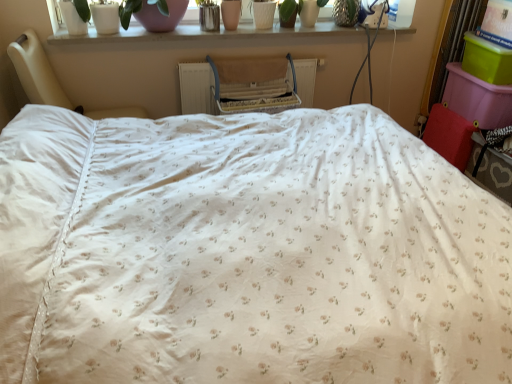
In order to face white plastic window screen at upper right, should I rotate leftwards or rightwards?

Rotate your view right by about 18.949°.

Describe the element at coordinates (246, 253) in the screenshot. The height and width of the screenshot is (384, 512). I see `white floral fabric bed at center` at that location.

Measure the distance between point (175,360) and camera.

Point (175,360) is 37.95 inches away from camera.

What is the approximate height of pink glass vase at upper center?

It is 8.57 inches.

At what (x,y) coordinates should I click in order to perform the action: click on white plastic radiator at center. Please return your answer as a coordinate pair (x, y). The height and width of the screenshot is (384, 512). Looking at the image, I should click on (246, 85).

Locate an element on the screen. The image size is (512, 384). white matte pot at upper center is located at coordinates (300, 11).

Is point (198, 33) more distant than point (290, 3)?

No, it is in front of (290, 3).

Find the location of a particular element. This screenshot has width=512, height=384. plant behind the white painted wood at upper center is located at coordinates (300, 11).

From the image's perspective, is white painted wood at upper center above white matte pot at upper center?

Actually, white painted wood at upper center appears below white matte pot at upper center in the image.

Is white matte pot at upper center completely or partially inside white painted wood at upper center?

No, white painted wood at upper center does not contain white matte pot at upper center.

Could you tell me if white painted wood at upper center is facing white floral fabric bed at center?

Yes.

Which of these two, white painted wood at upper center or white floral fabric bed at center, is bigger?

white floral fabric bed at center is bigger.

Does white painted wood at upper center contain white floral fabric bed at center?

No, white floral fabric bed at center is not inside white painted wood at upper center.

Can you confirm if white painted wood at upper center is wider than white floral fabric bed at center?

No, white painted wood at upper center is not wider than white floral fabric bed at center.

From the image's perspective, is white matte pot at upper center below white fabric bed at left?

Actually, white matte pot at upper center appears above white fabric bed at left in the image.

In the scene shown: Which object is positioned more to the right, white matte pot at upper center or white fabric bed at left?

From the viewer's perspective, white matte pot at upper center appears more on the right side.

Considering the relative positions of white matte pot at upper center and white fabric bed at left in the image provided, is white matte pot at upper center behind white fabric bed at left?

Yes, white matte pot at upper center is further from the viewer.

In terms of width, does white matte pot at upper center look wider or thinner when compared to white fabric bed at left?

white matte pot at upper center is thinner than white fabric bed at left.

Locate an element on the screen. Image resolution: width=512 pixels, height=384 pixels. window screen that appears above the pink glass vase at upper center (from the image's perspective) is located at coordinates (399, 14).

What's the angular difference between white plastic window screen at upper right and pink glass vase at upper center's facing directions?

They differ by 6.16 degrees in their facing directions.

Between white plastic window screen at upper right and pink glass vase at upper center, which one has smaller width?

white plastic window screen at upper right.

Would you say white fabric bed at left is inside or outside white plastic window screen at upper right?

white fabric bed at left exists outside the volume of white plastic window screen at upper right.

Is white fabric bed at left bigger than white plastic window screen at upper right?

Yes.

Considering the relative sizes of white fabric bed at left and white plastic window screen at upper right in the image provided, is white fabric bed at left wider than white plastic window screen at upper right?

Yes, white fabric bed at left is wider than white plastic window screen at upper right.

Where is `window screen above the white fabric bed at left (from a real-world perspective)`? window screen above the white fabric bed at left (from a real-world perspective) is located at coordinates (399, 14).

Is point (369, 21) closer or farther from the camera than point (124, 39)?

Point (369, 21).

Considering the positions of objects white plastic window screen at upper right and white painted wood at upper center in the image provided, who is more to the right, white plastic window screen at upper right or white painted wood at upper center?

From the viewer's perspective, white plastic window screen at upper right appears more on the right side.

Is white plastic window screen at upper right positioned with its back to white painted wood at upper center?

That's not correct — white plastic window screen at upper right is not looking away from white painted wood at upper center.

Considering the points (284, 7) and (118, 36), which point is in front, point (284, 7) or point (118, 36)?

The point (118, 36) is closer.

Consider the image. In terms of height, does white matte pot at upper center look taller or shorter compared to white painted wood at upper center?

In the image, white matte pot at upper center appears to be taller than white painted wood at upper center.

Is white matte pot at upper center inside or outside of white painted wood at upper center?

white matte pot at upper center is not inside white painted wood at upper center, it's outside.

Considering the sizes of white matte pot at upper center and white painted wood at upper center in the image, is white matte pot at upper center wider or thinner than white painted wood at upper center?

Clearly, white matte pot at upper center has less width compared to white painted wood at upper center.

Where is `plant lying above the white painted wood at upper center (from the image's perspective)`? This screenshot has width=512, height=384. plant lying above the white painted wood at upper center (from the image's perspective) is located at coordinates (300, 11).

Locate an element on the screen. window sill above the white floral fabric bed at center (from a real-world perspective) is located at coordinates (205, 34).

Estimate the real-world distances between objects in this image. Which object is closer to white matte pot at upper center, white fabric bed at left or white painted wood at upper center?

Based on the image, white painted wood at upper center appears to be nearer to white matte pot at upper center.

Which object lies further to the anchor point white plastic window screen at upper right, white plastic radiator at center or white painted wood at upper center?

The object further to white plastic window screen at upper right is white plastic radiator at center.

Estimate the real-world distances between objects in this image. Which object is further from white floral fabric bed at center, white matte pot at upper center or white plastic window screen at upper right?

Based on the image, white plastic window screen at upper right appears to be further to white floral fabric bed at center.

Based on their spatial positions, is white floral fabric bed at center or pink glass vase at upper center further from white fabric bed at left?

white floral fabric bed at center is further to white fabric bed at left.

Considering their positions, is pink glass vase at upper center positioned further to white painted wood at upper center than white floral fabric bed at center?

white floral fabric bed at center.

When comparing their distances from white plastic window screen at upper right, does white matte pot at upper center or white painted wood at upper center seem closer?

Based on the image, white painted wood at upper center appears to be nearer to white plastic window screen at upper right.

In the scene shown: Considering their positions, is white plastic window screen at upper right positioned further to white painted wood at upper center than pink glass vase at upper center?

Among the two, white plastic window screen at upper right is located further to white painted wood at upper center.

Looking at the image, which one is located further to white painted wood at upper center, white matte pot at upper center or white floral fabric bed at center?

white floral fabric bed at center lies further to white painted wood at upper center than the other object.

Locate an element on the screen. Image resolution: width=512 pixels, height=384 pixels. window sill between white fabric bed at left and white matte pot at upper center in the horizontal direction is located at coordinates (205, 34).

Locate an element on the screen. The image size is (512, 384). window sill located between white fabric bed at left and white plastic radiator at center in the left-right direction is located at coordinates (205, 34).

Identify the location of glass vase between white fabric bed at left and white plastic window screen at upper right. The image size is (512, 384). (161, 15).

Find the location of a particular element. The width and height of the screenshot is (512, 384). radiator between white fabric bed at left and white plastic window screen at upper right in the horizontal direction is located at coordinates (246, 85).